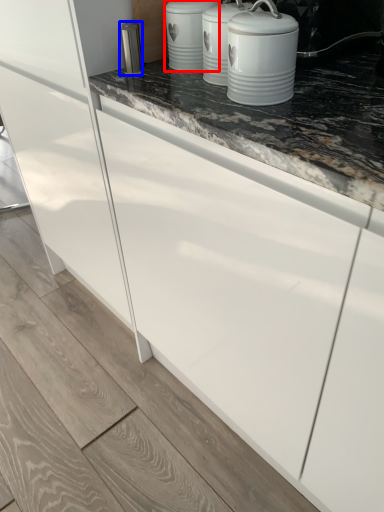
Question: Which object appears closest to the camera in this image, kitchen appliance (highlighted by a red box) or appliance (highlighted by a blue box)?

Choices:
 (A) kitchen appliance
 (B) appliance

Answer: (A)